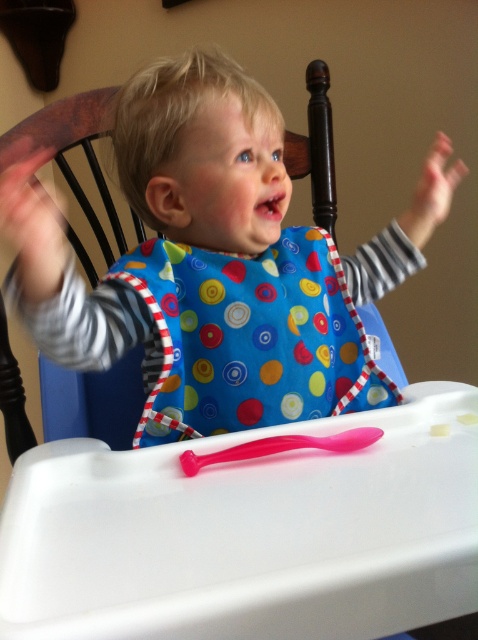
You are a photographer standing 20 inches away from the blue fabric bib at center. Can you reach it without moving your position?

The blue fabric bib at center is 18.50 inches away from the viewer, so yes, you can reach it without moving your position since you are only 20 inches away.